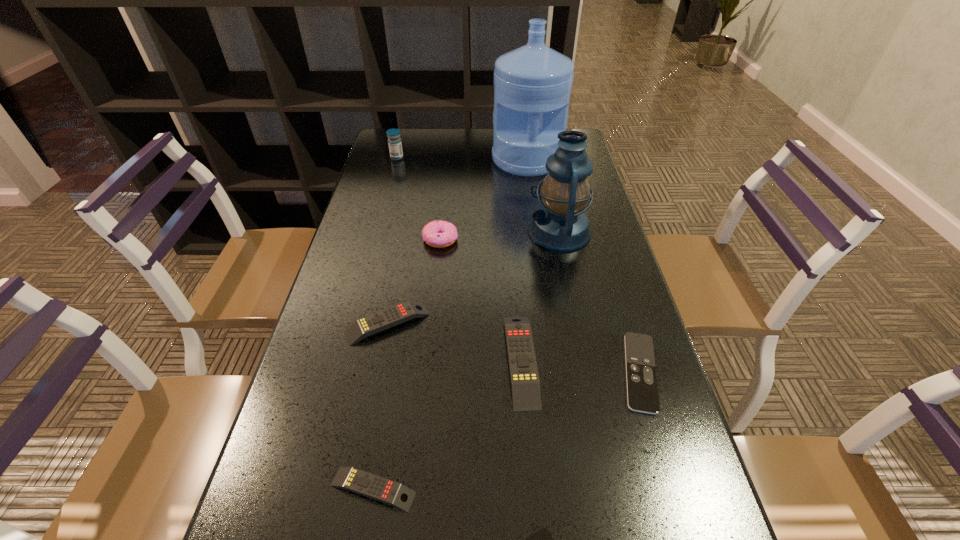
Locate an element on the screen. the second biggest yellow remote control is located at coordinates (377, 322).

Image resolution: width=960 pixels, height=540 pixels. In order to click on the fourth shortest remote control in this screenshot , I will do `click(377, 322)`.

This screenshot has height=540, width=960. What are the coordinates of `the third tallest remote control` in the screenshot? It's located at (363, 483).

The width and height of the screenshot is (960, 540). Find the location of `the second nearest remote control`. the second nearest remote control is located at coordinates (363, 483).

You are a GUI agent. You are given a task and a screenshot of the screen. Output one action in this format:
    pyautogui.click(x=<x>, y=<y>)
    Task: Click on the second shortest object
    This screenshot has width=960, height=540.
    Given the screenshot: What is the action you would take?
    pyautogui.click(x=642, y=390)

Where is `the second shortest remote control`? Image resolution: width=960 pixels, height=540 pixels. the second shortest remote control is located at coordinates (642, 390).

Locate an element on the screen. Image resolution: width=960 pixels, height=540 pixels. vacant area situated on the side of the water jug with the handle is located at coordinates (540, 247).

Identify the location of free space located 0.110m on the face of the second tallest object. The image size is (960, 540). (489, 232).

The height and width of the screenshot is (540, 960). Find the location of `vacant space located on the face of the second tallest object`. vacant space located on the face of the second tallest object is located at coordinates (468, 232).

You are a GUI agent. You are given a task and a screenshot of the screen. Output one action in this format:
    pyautogui.click(x=<x>, y=<y>)
    Task: Click on the vacant space positioned on the face of the second tallest object
    This screenshot has height=540, width=960.
    Given the screenshot: What is the action you would take?
    pyautogui.click(x=471, y=232)